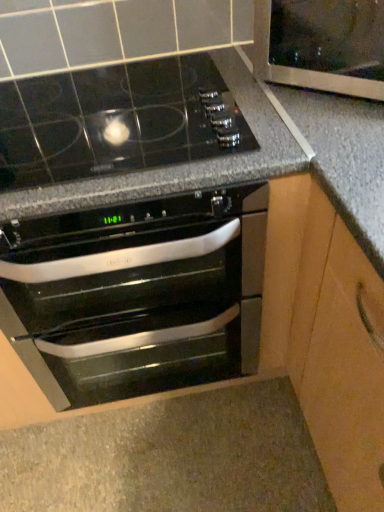
Where is `transparent glass door at upper right`? Image resolution: width=384 pixels, height=512 pixels. transparent glass door at upper right is located at coordinates (329, 46).

The image size is (384, 512). Describe the element at coordinates (329, 46) in the screenshot. I see `transparent glass door at upper right` at that location.

Where is `black glass oven at center`? The width and height of the screenshot is (384, 512). black glass oven at center is located at coordinates pyautogui.click(x=138, y=296).

Measure the distance between point (26, 231) and camera.

The depth of point (26, 231) is 30.67 inches.

Describe the element at coordinates (138, 296) in the screenshot. The height and width of the screenshot is (512, 384). I see `black glass oven at center` at that location.

Locate an element on the screen. The width and height of the screenshot is (384, 512). transparent glass door at upper right is located at coordinates (329, 46).

Considering the positions of objects black glass oven at center and transparent glass door at upper right in the image provided, who is more to the right, black glass oven at center or transparent glass door at upper right?

transparent glass door at upper right is more to the right.

Relative to transparent glass door at upper right, is black glass oven at center in front or behind?

black glass oven at center is in front of transparent glass door at upper right.

Does point (190, 265) come in front of point (283, 81)?

No, it is not.

From the image's perspective, which object appears higher, black glass oven at center or transparent glass door at upper right?

transparent glass door at upper right is shown above in the image.

Consider the image. From a real-world perspective, relative to transparent glass door at upper right, is black glass oven at center vertically above or below?

black glass oven at center is below transparent glass door at upper right.

Considering the sizes of black glass oven at center and transparent glass door at upper right in the image, is black glass oven at center wider or thinner than transparent glass door at upper right?

black glass oven at center is wider than transparent glass door at upper right.

Can you confirm if black glass oven at center is taller than transparent glass door at upper right?

Indeed, black glass oven at center has a greater height compared to transparent glass door at upper right.

Based on their sizes in the image, would you say black glass oven at center is bigger or smaller than transparent glass door at upper right?

black glass oven at center is bigger than transparent glass door at upper right.

Is black glass oven at center inside or outside of transparent glass door at upper right?

black glass oven at center is not enclosed by transparent glass door at upper right.

Is black glass oven at center far away from transparent glass door at upper right?

No, black glass oven at center is in close proximity to transparent glass door at upper right.

Is black glass oven at center facing towards transparent glass door at upper right?

No, black glass oven at center does not turn towards transparent glass door at upper right.

This screenshot has width=384, height=512. What are the coordinates of `oven beneath the transparent glass door at upper right (from a real-world perspective)` in the screenshot? It's located at (138, 296).

Is transparent glass door at upper right to the right of black glass oven at center from the viewer's perspective?

Indeed, transparent glass door at upper right is positioned on the right side of black glass oven at center.

Considering the positions of objects transparent glass door at upper right and black glass oven at center in the image provided, who is in front, transparent glass door at upper right or black glass oven at center?

Positioned in front is black glass oven at center.

Which is behind, point (331, 31) or point (164, 337)?

The point (164, 337) is behind.

From the picture: From the image's perspective, is transparent glass door at upper right located above black glass oven at center?

Yes, from the image's perspective, transparent glass door at upper right is over black glass oven at center.

From a real-world perspective, which is physically below, transparent glass door at upper right or black glass oven at center?

black glass oven at center is physically lower.

Is transparent glass door at upper right wider or thinner than black glass oven at center?

transparent glass door at upper right is thinner than black glass oven at center.

Can you confirm if transparent glass door at upper right is taller than black glass oven at center?

Incorrect, the height of transparent glass door at upper right is not larger of that of black glass oven at center.

Considering the sizes of transparent glass door at upper right and black glass oven at center in the image, is transparent glass door at upper right bigger or smaller than black glass oven at center?

transparent glass door at upper right is smaller than black glass oven at center.

Would you say black glass oven at center is part of transparent glass door at upper right's contents?

No.

Is transparent glass door at upper right next to black glass oven at center?

No, transparent glass door at upper right is not touching black glass oven at center.

Based on the photo, is transparent glass door at upper right aimed at black glass oven at center?

No, transparent glass door at upper right is not facing towards black glass oven at center.

You are a GUI agent. You are given a task and a screenshot of the screen. Output one action in this format:
    pyautogui.click(x=<x>, y=<y>)
    Task: Click on the oven below the transparent glass door at upper right (from the image's perspective)
    The image size is (384, 512).
    Given the screenshot: What is the action you would take?
    pyautogui.click(x=138, y=296)

Image resolution: width=384 pixels, height=512 pixels. Identify the location of oven that is under the transparent glass door at upper right (from a real-world perspective). (138, 296).

Identify the location of oven located on the left of transparent glass door at upper right. (138, 296).